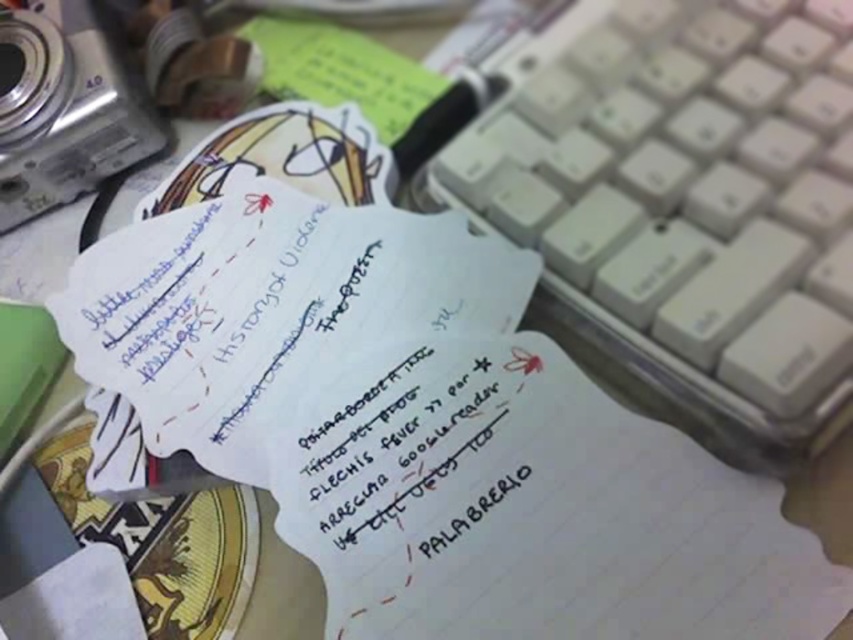
Question: Can you confirm if white plastic keyboard at center is positioned to the right of white paper at center?

Choices:
 (A) yes
 (B) no

Answer: (A)

Question: Is white plastic keyboard at center closer to the viewer compared to green paper at upper center?

Choices:
 (A) no
 (B) yes

Answer: (B)

Question: Which of these objects is positioned farthest from the silver metallic camera at upper left?

Choices:
 (A) green paper at upper center
 (B) white plastic keyboard at center

Answer: (B)

Question: Is silver metallic camera at upper left closer to the viewer compared to green paper at upper center?

Choices:
 (A) yes
 (B) no

Answer: (B)

Question: Which object is farther from the camera taking this photo?

Choices:
 (A) silver metallic camera at upper left
 (B) white plastic keyboard at center
 (C) green paper at upper center
 (D) white paper at center

Answer: (A)

Question: Estimate the real-world distances between objects in this image. Which object is closer to the silver metallic camera at upper left?

Choices:
 (A) white paper at center
 (B) white plastic keyboard at center

Answer: (A)